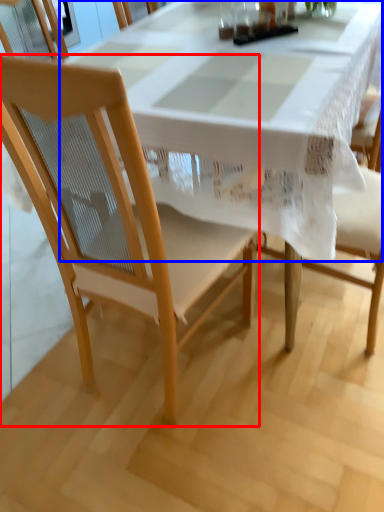
Question: Among these objects, which one is nearest to the camera, chair (highlighted by a red box) or tablecloth (highlighted by a blue box)?

Choices:
 (A) chair
 (B) tablecloth

Answer: (A)